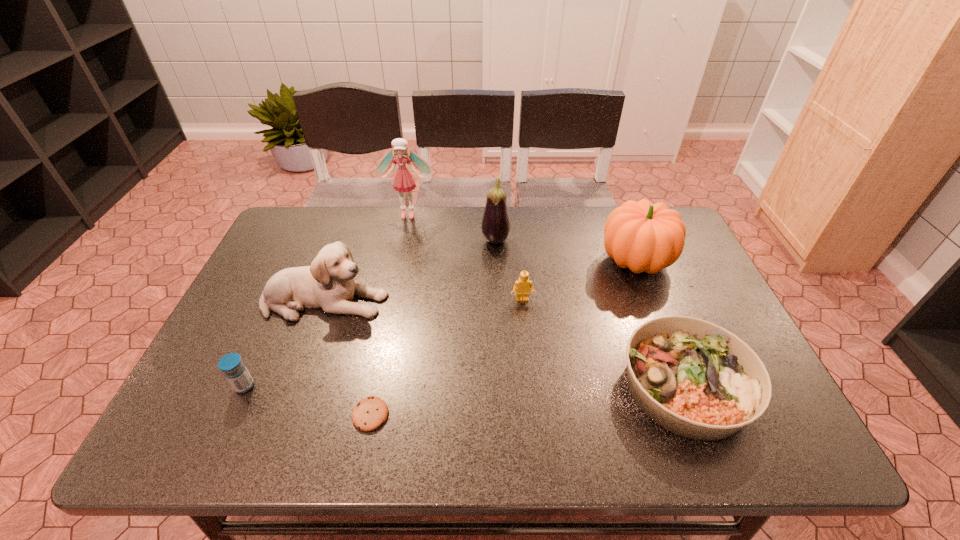
This screenshot has height=540, width=960. I want to click on free space at the left edge, so point(267,347).

Find the location of `vacant point at the right edge`. vacant point at the right edge is located at coordinates (712, 289).

In the image, there is a desktop. Where is `free region at the far left corner`? The height and width of the screenshot is (540, 960). free region at the far left corner is located at coordinates (293, 240).

Find the location of a particular element. The width and height of the screenshot is (960, 540). vacant region at the near right corner of the desktop is located at coordinates (775, 419).

Find the location of a particular element. The height and width of the screenshot is (540, 960). unoccupied position between the medicine and the Lego is located at coordinates (383, 343).

This screenshot has width=960, height=540. Find the location of `vacant space in between the farthest object and the puppy`. vacant space in between the farthest object and the puppy is located at coordinates (367, 257).

Identify the location of vacant area that lies between the doll and the cookie. (390, 314).

Where is `free space between the Lego and the shortest object`? free space between the Lego and the shortest object is located at coordinates tap(446, 357).

Locate an element on the screen. The width and height of the screenshot is (960, 540). vacant region between the farthest object and the Lego is located at coordinates (466, 256).

Image resolution: width=960 pixels, height=540 pixels. I want to click on empty space that is in between the puppy and the cookie, so click(348, 358).